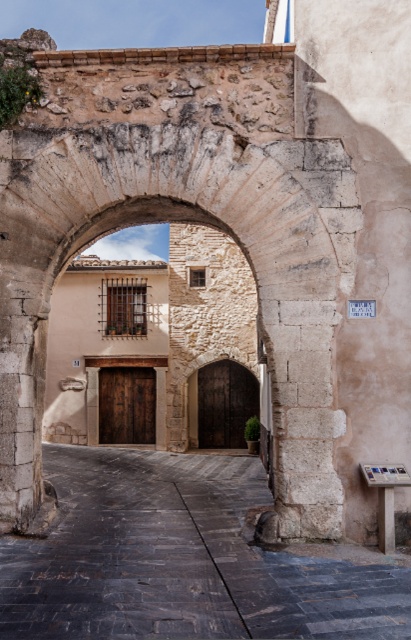
You are a tourist standing in front of the historic site. You see the stone archway at center and the dark stone alley at center. Which object is located above the other?

The stone archway at center is positioned over the dark stone alley at center, so the stone archway at center is above the dark stone alley at center.

You are a painter standing at the entrance of the courtyard. You want to paint the stone archway at center and the dark stone alley at center. Which object should you focus on first if you want to paint the taller structure first?

The stone archway at center is taller than the dark stone alley at center, so you should focus on painting the stone archway at center first.

You are a tour guide explaining the layout of the courtyard. You mention both the stone archway at center and the dark stone alley at center. Which one is narrower in width?

The stone archway at center is smaller than the dark stone alley at center, so the stone archway at center is narrower in width.